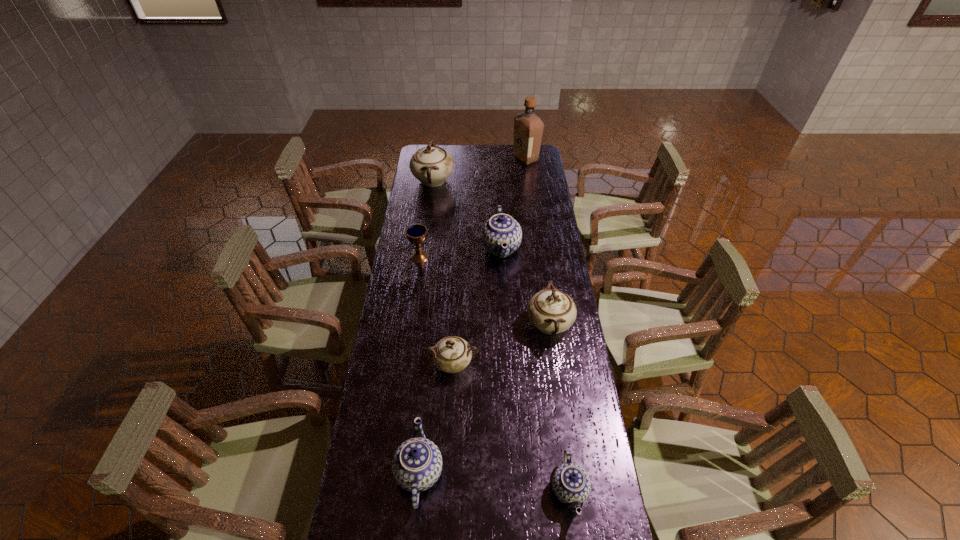
The height and width of the screenshot is (540, 960). Identify the location of free space that satisfies the following two spatial constraints: 1. on the front side of the chalice; 2. on the left side of the rightmost white chinaware. (411, 324).